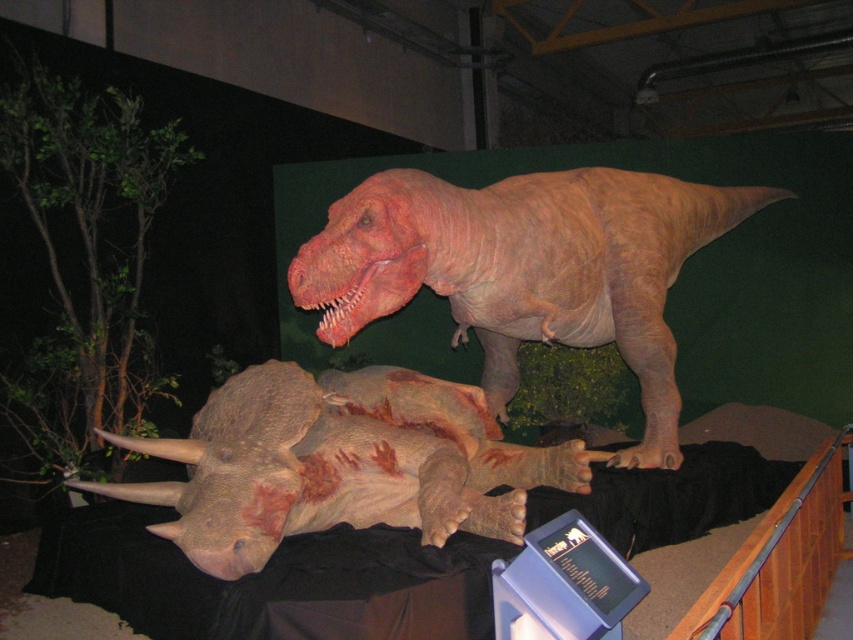
You are standing at the point marked as point (692,236) in the museum. The camera is positioned 5.40 meters away from this point. If you want to take a photo of the Triceratops and the T. rex models using this camera, will you be able to capture both dinosaurs in the same frame?

The camera is positioned 5.40 meters away from point (692,236). Since both the Triceratops and T. rex are part of the museum exhibit, their positions relative to the camera would determine if they fit in the frame. However, without knowing the exact field of view of the camera or the distance between the dinosaurs, it is impossible to definitively say if both can be captured in the same frame. Additional information about the camera specifications or the spatial arrangement of the dinosaurs is needed to

You are standing in the museum and see the Triceratops lying on its side on the black cloth. There is also a point marked at coordinates (526,268). Which dinosaur does this point correspond to?

The point at coordinates (526,268) corresponds to the smooth tan dinosaur at upper center, which is the Tyrannosaurus rex.

You are a visitor at the museum and want to take a photo of both the Triceratops and the T. rex. You notice two points marked on the floor at coordinates point [581,272] and point [251,449]. Which point should you stand at to ensure both dinosaurs are in the frame without needing to move your camera position?

You should stand at point [581,272] because it is closer to the camera, allowing both the Triceratops and the T. rex to be in the frame simultaneously.